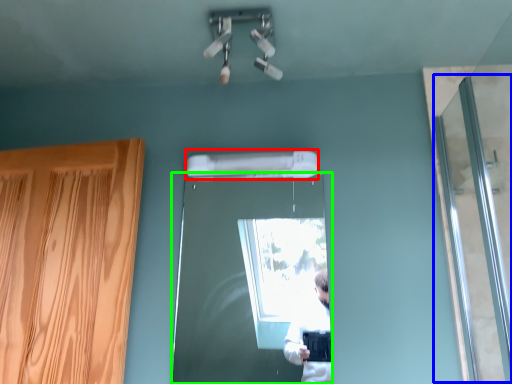
Question: Considering the real-world distances, which object is closest to air conditioner (highlighted by a red box)? screen door (highlighted by a blue box) or door (highlighted by a green box).

Choices:
 (A) screen door
 (B) door

Answer: (A)